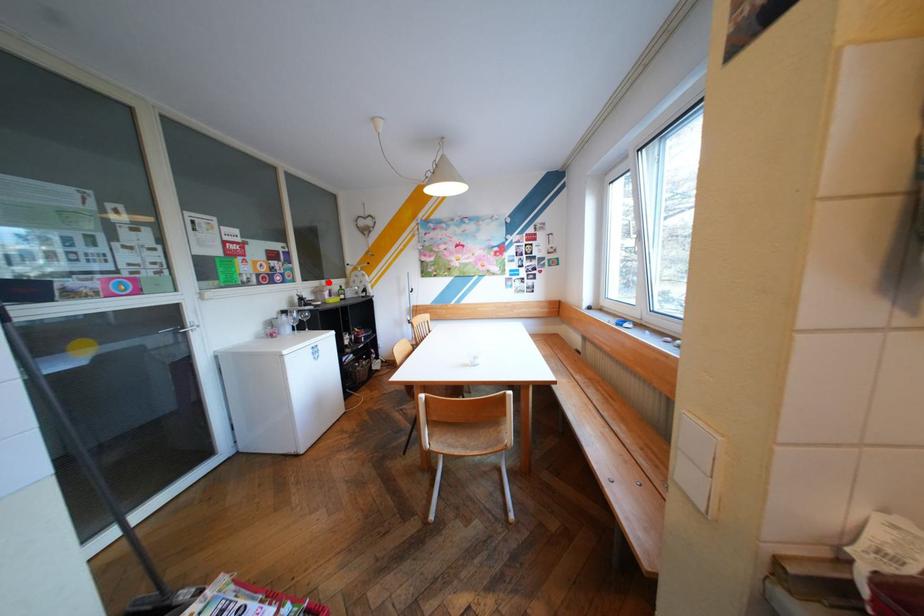
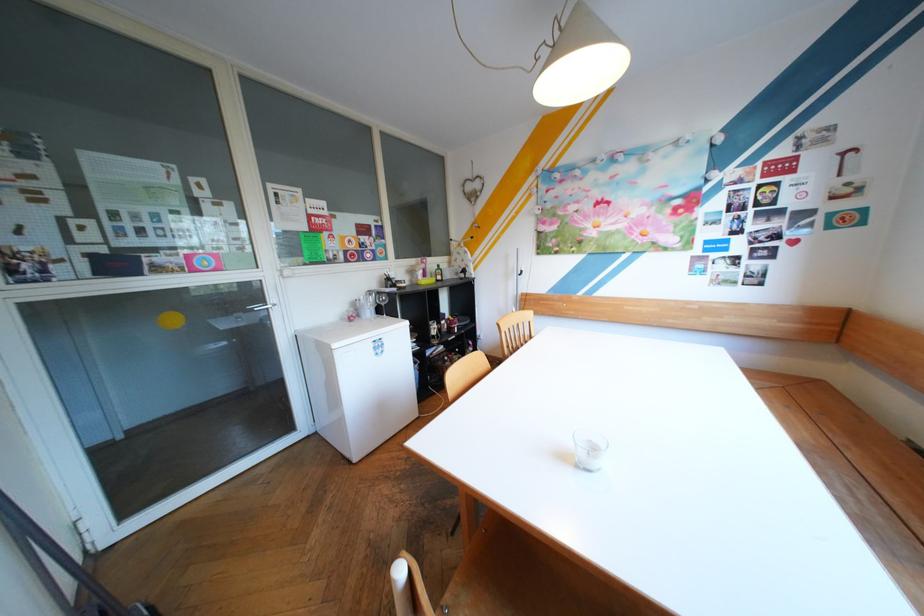
The point at the highlighted location is marked in the first image. Where is the corresponding point in the second image?

(426, 261)